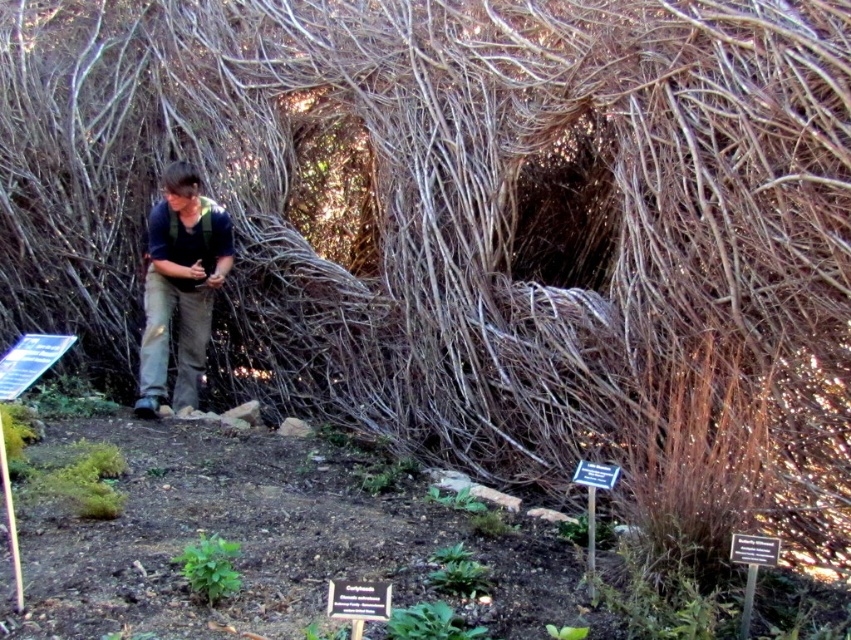
In the scene shown: You are standing at the origin point in the scene. Where is the brown cotton pants at center located in terms of coordinates?

The brown cotton pants at center is located at coordinates point [180,288].